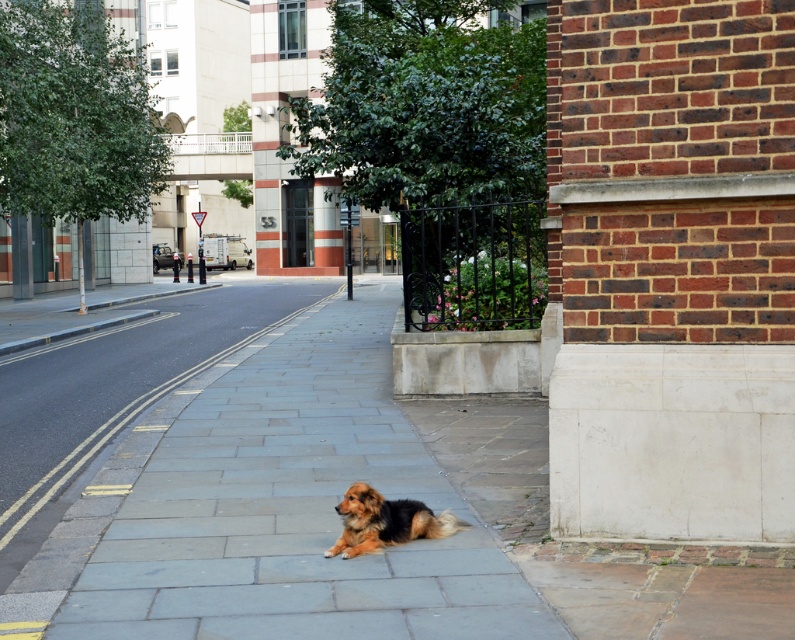
Question: Among these points, which one is nearest to the camera?

Choices:
 (A) (410, 524)
 (B) (173, 396)

Answer: (A)

Question: Where is gray stone pavement at center located in relation to brown fluffy dog at center in the image?

Choices:
 (A) below
 (B) above

Answer: (B)

Question: Which object is closer to the camera taking this photo?

Choices:
 (A) gray stone pavement at center
 (B) brown fluffy dog at center

Answer: (A)

Question: Observing the image, what is the correct spatial positioning of gray stone pavement at center in reference to brown fluffy dog at center?

Choices:
 (A) right
 (B) left

Answer: (B)

Question: Does gray stone pavement at center have a smaller size compared to brown fluffy dog at center?

Choices:
 (A) yes
 (B) no

Answer: (B)

Question: Which point is closer to the camera?

Choices:
 (A) click(401, 531)
 (B) click(113, 483)

Answer: (A)